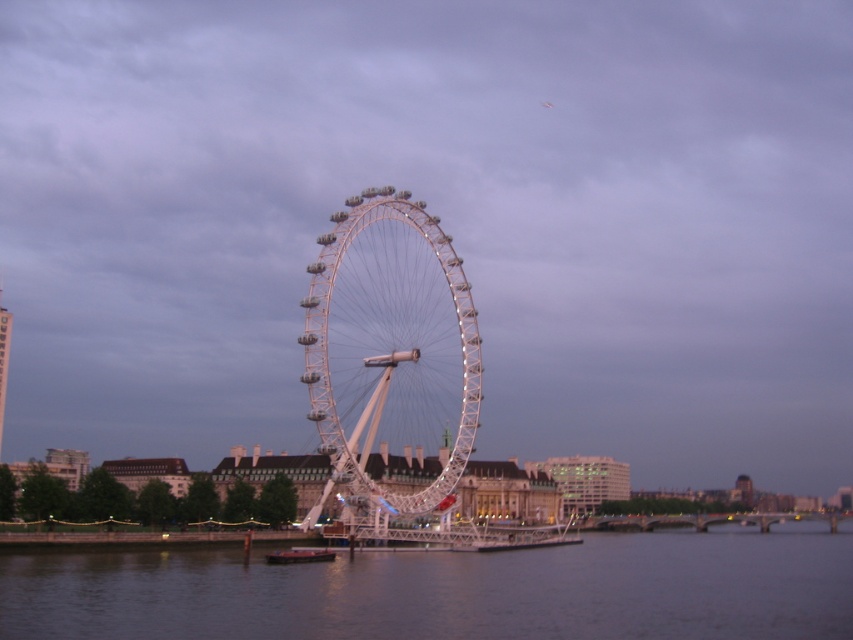
Question: Can you confirm if dark blue water at center is positioned to the left of metallic gray barge at lower center?

Choices:
 (A) no
 (B) yes

Answer: (A)

Question: Which of the following is the farthest from the observer?

Choices:
 (A) dark blue water at center
 (B) metallic gray barge at lower center

Answer: (B)

Question: Is dark blue water at center to the right of metallic gray barge at lower center from the viewer's perspective?

Choices:
 (A) no
 (B) yes

Answer: (B)

Question: Which point is closer to the camera taking this photo?

Choices:
 (A) pyautogui.click(x=407, y=282)
 (B) pyautogui.click(x=727, y=634)

Answer: (B)

Question: Is dark blue water at center bigger than metallic gray barge at lower center?

Choices:
 (A) no
 (B) yes

Answer: (B)

Question: Which of the following is the farthest from the observer?

Choices:
 (A) dark blue water at center
 (B) metallic gray barge at lower center

Answer: (B)